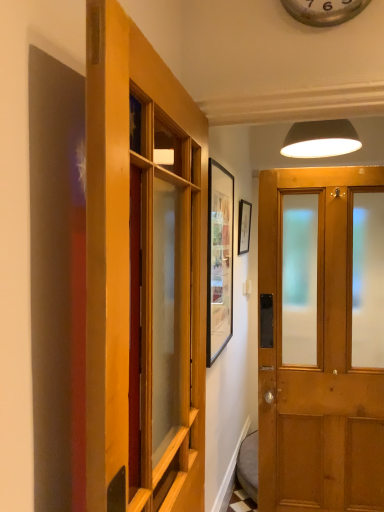
Question: Is matte black lampshade at upper center bigger than wooden door at center, arranged as the first door when viewed from the left?

Choices:
 (A) no
 (B) yes

Answer: (A)

Question: Considering the relative positions of matte black lampshade at upper center and wooden door at center, arranged as the first door when viewed from the left, in the image provided, is matte black lampshade at upper center behind wooden door at center, arranged as the first door when viewed from the left,?

Choices:
 (A) no
 (B) yes

Answer: (B)

Question: From a real-world perspective, is matte black lampshade at upper center physically above wooden door at center, arranged as the first door when viewed from the left?

Choices:
 (A) yes
 (B) no

Answer: (A)

Question: Is matte black lampshade at upper center taller than wooden door at center, marked as the second door in a right-to-left arrangement?

Choices:
 (A) yes
 (B) no

Answer: (B)

Question: Considering the relative sizes of matte black lampshade at upper center and wooden door at center, arranged as the first door when viewed from the left, in the image provided, is matte black lampshade at upper center wider than wooden door at center, arranged as the first door when viewed from the left,?

Choices:
 (A) yes
 (B) no

Answer: (A)

Question: Are matte black lampshade at upper center and wooden door at center, marked as the second door in a right-to-left arrangement, located far from each other?

Choices:
 (A) yes
 (B) no

Answer: (A)

Question: Is metallic silver clock at upper center positioned beyond the bounds of wooden door at center, arranged as the first door when viewed from the right?

Choices:
 (A) no
 (B) yes

Answer: (B)

Question: Is metallic silver clock at upper center not close to wooden door at center, marked as the 2th door in a left-to-right arrangement?

Choices:
 (A) no
 (B) yes

Answer: (B)

Question: Can you confirm if metallic silver clock at upper center is positioned to the right of wooden door at center, arranged as the first door when viewed from the right?

Choices:
 (A) yes
 (B) no

Answer: (A)

Question: Is metallic silver clock at upper center further to camera compared to wooden door at center, marked as the 2th door in a left-to-right arrangement?

Choices:
 (A) no
 (B) yes

Answer: (B)

Question: Is metallic silver clock at upper center in contact with wooden door at center, marked as the 2th door in a left-to-right arrangement?

Choices:
 (A) yes
 (B) no

Answer: (B)

Question: Is metallic silver clock at upper center positioned with its back to wooden door at center, marked as the 2th door in a left-to-right arrangement?

Choices:
 (A) yes
 (B) no

Answer: (B)

Question: Does metallic silver clock at upper center turn towards wooden door at center, marked as the second door in a right-to-left arrangement?

Choices:
 (A) yes
 (B) no

Answer: (B)